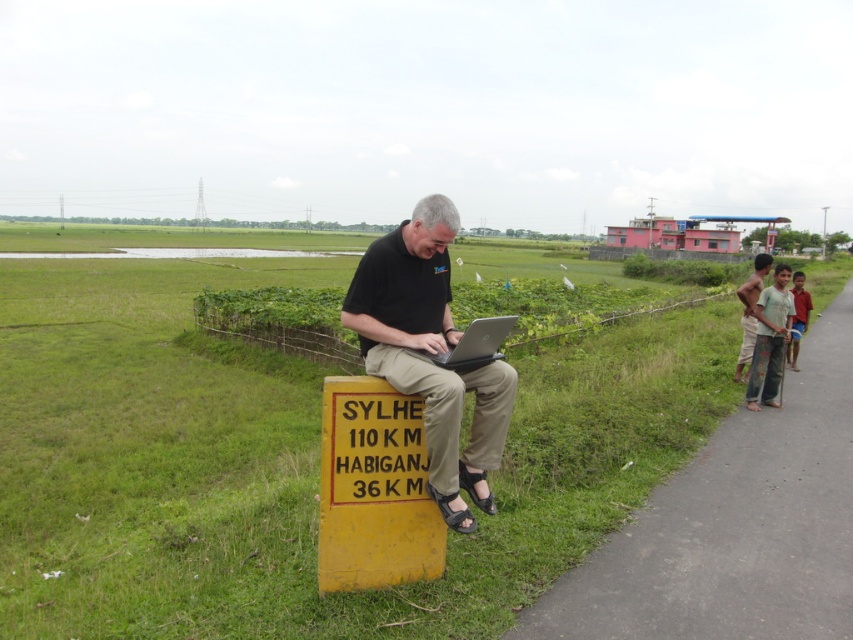
Question: Can you confirm if silver metallic laptop at center is positioned below black leather sandal at lower center?

Choices:
 (A) no
 (B) yes

Answer: (A)

Question: Which point is farther to the camera?

Choices:
 (A) green cotton shirt at right
 (B) black leather sandal at lower center
 (C) asphalt road at right

Answer: (A)

Question: Can you confirm if green cotton shirt at right is smaller than black leather sandal at lower center?

Choices:
 (A) yes
 (B) no

Answer: (B)

Question: Observing the image, what is the correct spatial positioning of black matte laptop at center in reference to black leather sandal at lower center?

Choices:
 (A) above
 (B) below

Answer: (A)

Question: Which point is closer to the camera?

Choices:
 (A) black matte laptop at center
 (B) silver metallic laptop at center
 (C) asphalt road at right
 (D) black leather sandal at lower center

Answer: (B)

Question: Which is nearer to the light brown pants at right?

Choices:
 (A) green cotton shirt at right
 (B) black leather sandal at lower center
 (C) yellow plastic sign at center

Answer: (A)